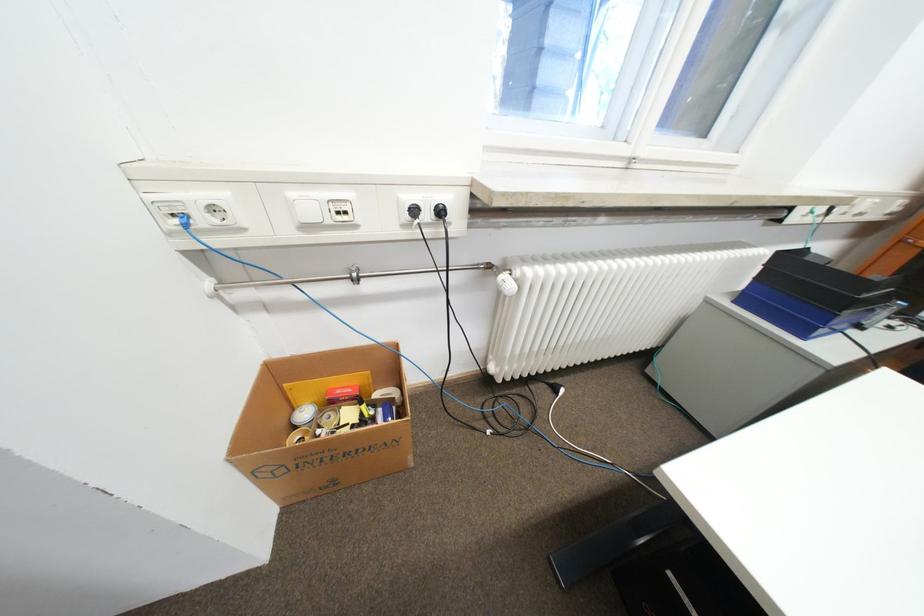
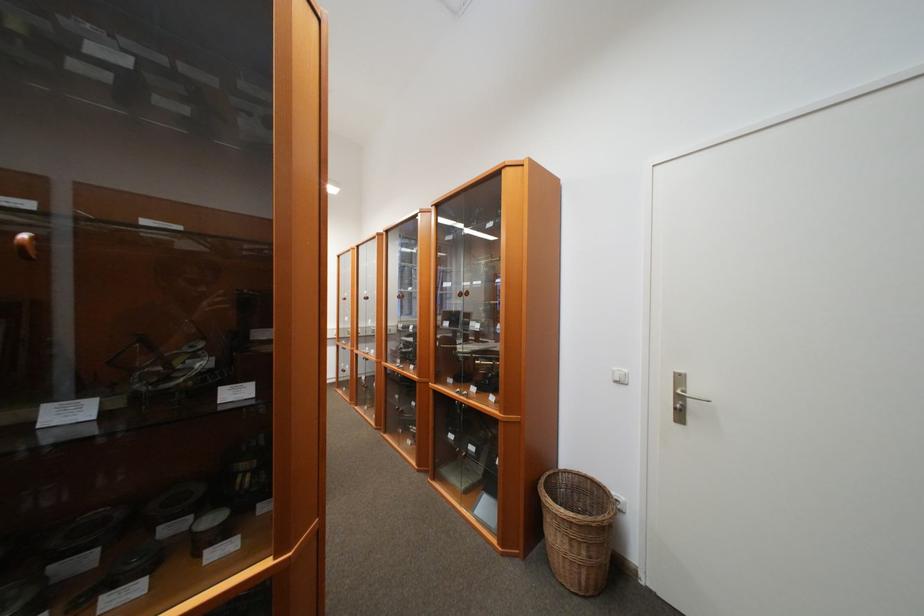
Question: I am providing you with two images of the same scene from different viewpoints. Please identify which objects are invisible in image2.

Choices:
 (A) silver door handle
 (B) radiator control knob
 (C) white light switch
 (D) small condiment jar

Answer: (B)